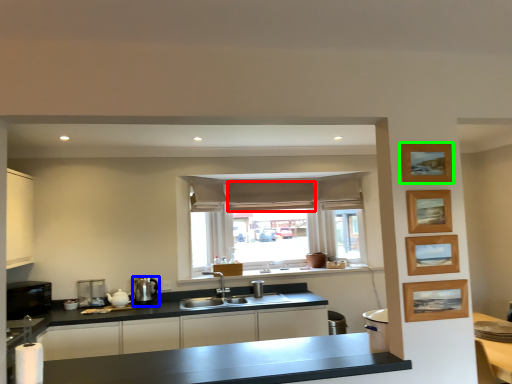
Question: Considering the real-world distances, which object is farthest from curtain (highlighted by a red box)? appliance (highlighted by a blue box) or picture frame (highlighted by a green box)?

Choices:
 (A) appliance
 (B) picture frame

Answer: (B)